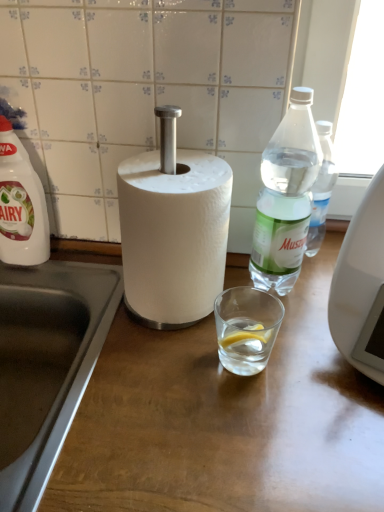
What are the coordinates of `unoccupied region to the right of white plastic bottle at left, the first bottle viewed from the left` in the screenshot? It's located at (78, 273).